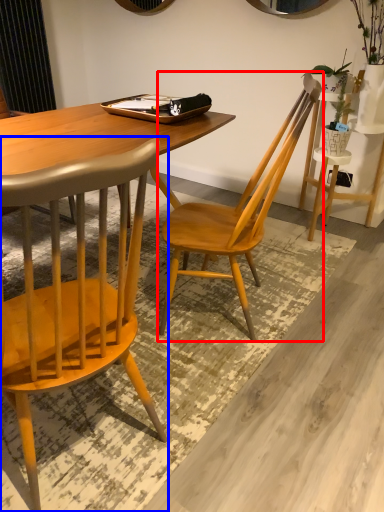
Question: Among these objects, which one is nearest to the camera, chair (highlighted by a red box) or chair (highlighted by a blue box)?

Choices:
 (A) chair
 (B) chair

Answer: (B)